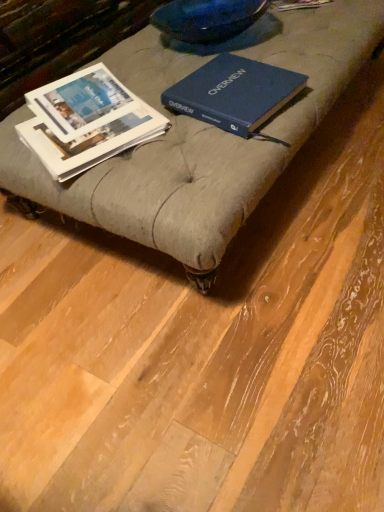
Find the location of `vacant region above white paper book at left, the 2th book viewed from the right (from a real-world perspective)`. vacant region above white paper book at left, the 2th book viewed from the right (from a real-world perspective) is located at coordinates (x=93, y=115).